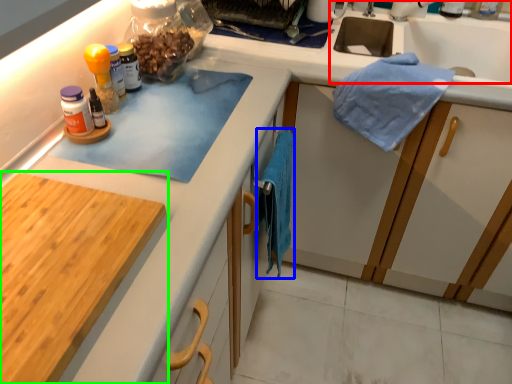
Question: Which is farther away from sink (highlighted by a red box)? bath towel (highlighted by a blue box) or cabinetry (highlighted by a green box)?

Choices:
 (A) bath towel
 (B) cabinetry

Answer: (B)